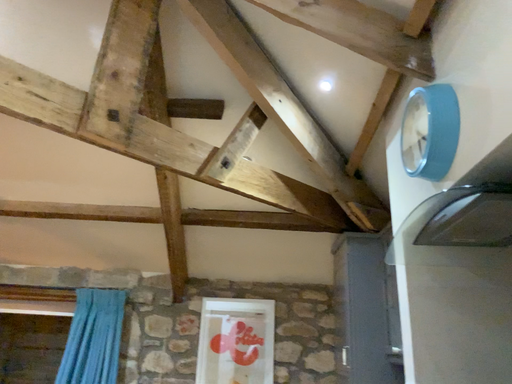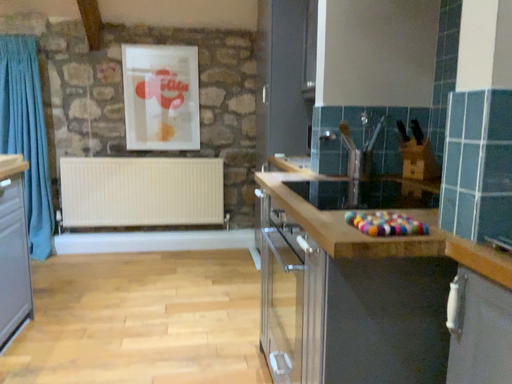
Question: How did the camera likely rotate when shooting the video?

Choices:
 (A) rotated right
 (B) rotated left

Answer: (A)